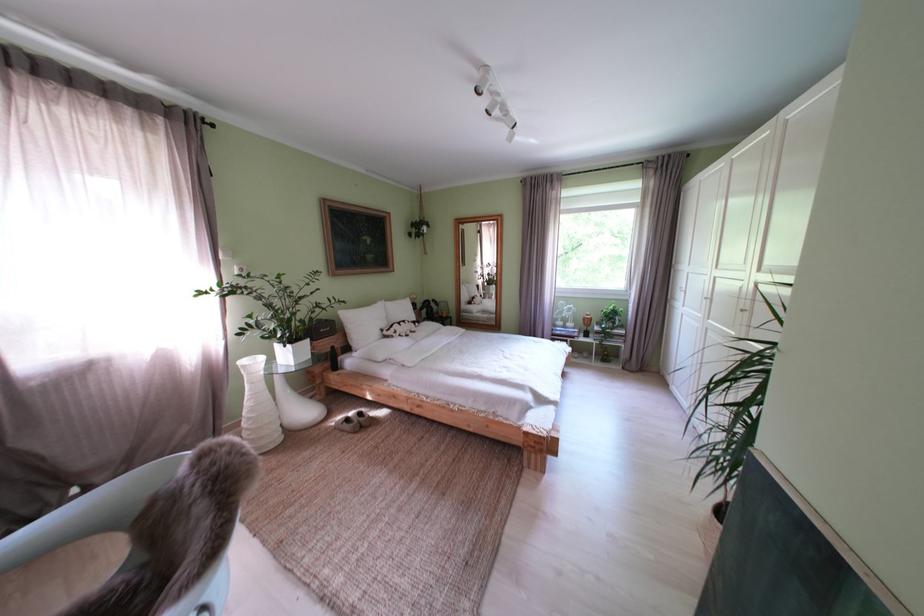
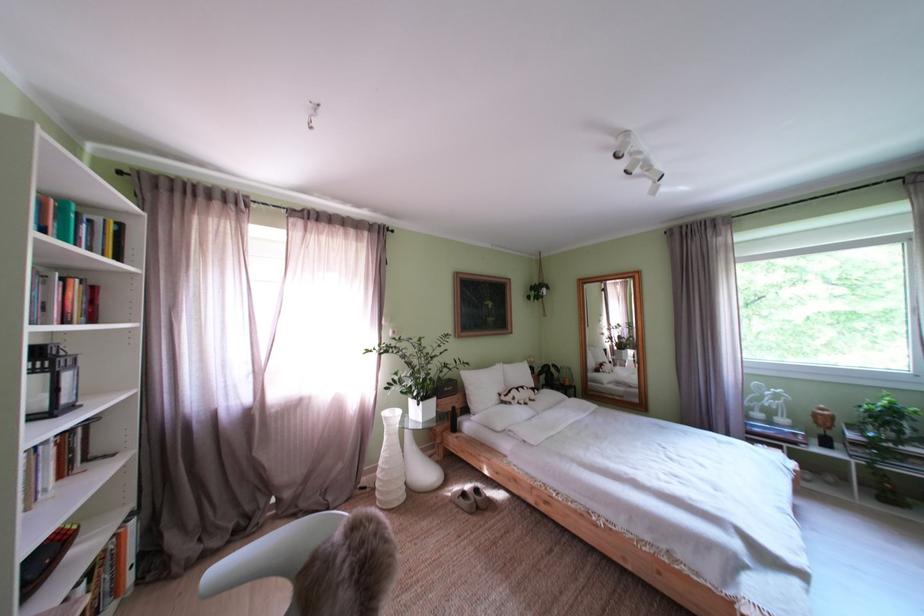
Find the pixel in the second image that matches the point at 517,122 in the first image.

(659, 175)